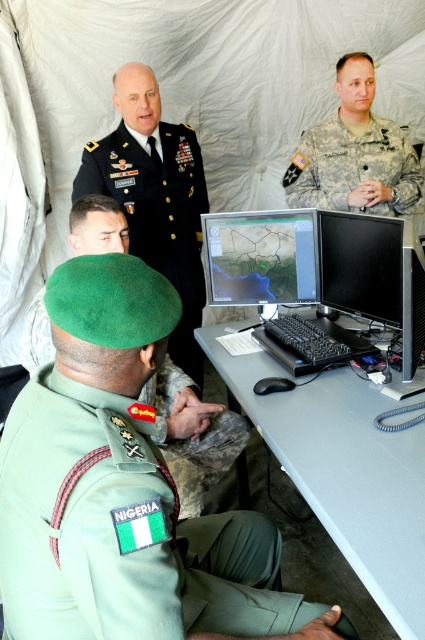
From the picture: Is green fabric uniform at center wider than green matte map at center?

Correct, the width of green fabric uniform at center exceeds that of green matte map at center.

This screenshot has height=640, width=425. What do you see at coordinates (124, 522) in the screenshot?
I see `green fabric uniform at center` at bounding box center [124, 522].

This screenshot has width=425, height=640. I want to click on green fabric uniform at center, so click(x=124, y=522).

Is gray plastic table at center bigger than green beret at center?

Yes.

Who is positioned more to the left, gray plastic table at center or green beret at center?

green beret at center

Is point (294, 422) positioned before point (119, 252)?

That is False.

At what (x,y) coordinates should I click in order to perform the action: click on gray plastic table at center. Please return your answer as a coordinate pair (x, y). The image size is (425, 640). Looking at the image, I should click on click(x=345, y=470).

Consider the image. Can you confirm if camouflage fabric uniform at upper center is shorter than black glossy monitor at center?

No, camouflage fabric uniform at upper center is not shorter than black glossy monitor at center.

Where is `camouflage fabric uniform at upper center`? camouflage fabric uniform at upper center is located at coordinates (354, 166).